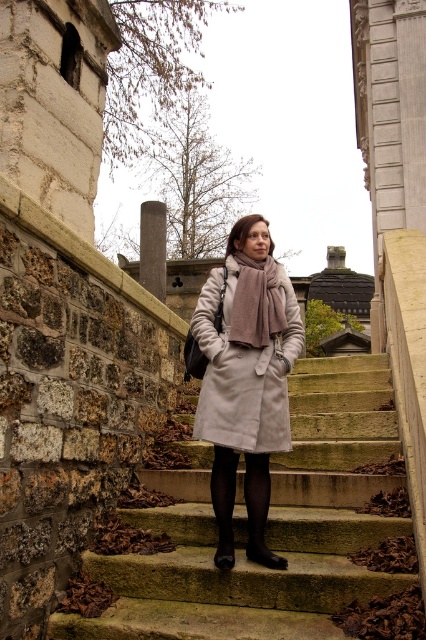
Question: In this image, where is light beige coat at center located relative to brown woolen scarf at center?

Choices:
 (A) left
 (B) right

Answer: (A)

Question: Which point is farther to the camera?

Choices:
 (A) smooth stone stairs at center
 (B) light beige coat at center

Answer: (B)

Question: Which point appears farthest from the camera in this image?

Choices:
 (A) (261, 488)
 (B) (250, 294)
 (C) (293, 308)

Answer: (C)

Question: Is light beige coat at center bigger than black leather boot at lower center?

Choices:
 (A) no
 (B) yes

Answer: (B)

Question: Which of the following is the closest to the observer?

Choices:
 (A) light beige coat at center
 (B) black leather boot at lower center
 (C) smooth stone stairs at center

Answer: (C)

Question: Can you confirm if light beige coat at center is positioned to the right of black tights at center?

Choices:
 (A) no
 (B) yes

Answer: (A)